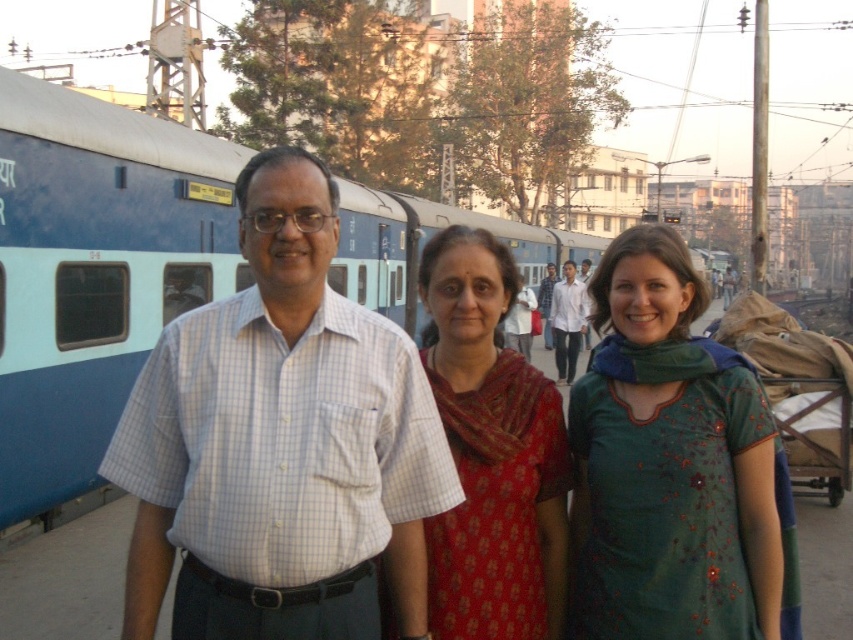
Between red silk saree at center and white shirt at center, which one appears on the left side from the viewer's perspective?

red silk saree at center is more to the left.

Can you confirm if red silk saree at center is thinner than white shirt at center?

No.

Find the location of `red silk saree at center`. red silk saree at center is located at coordinates (491, 452).

Does light blue checkered shirt at center lie in front of red silk saree at center?

That is True.

Between point (314, 582) and point (445, 305), which one is positioned behind?

Point (445, 305)

What do you see at coordinates (280, 442) in the screenshot? This screenshot has width=853, height=640. I see `light blue checkered shirt at center` at bounding box center [280, 442].

Locate an element on the screen. The image size is (853, 640). light blue checkered shirt at center is located at coordinates (280, 442).

Is blue painted metal train at left to the right of red silk saree at center from the viewer's perspective?

Indeed, blue painted metal train at left is positioned on the right side of red silk saree at center.

Is blue painted metal train at left above red silk saree at center?

Yes.

Which is in front, point (38, 276) or point (492, 612)?

Point (492, 612) is in front.

The image size is (853, 640). Identify the location of blue painted metal train at left. (94, 272).